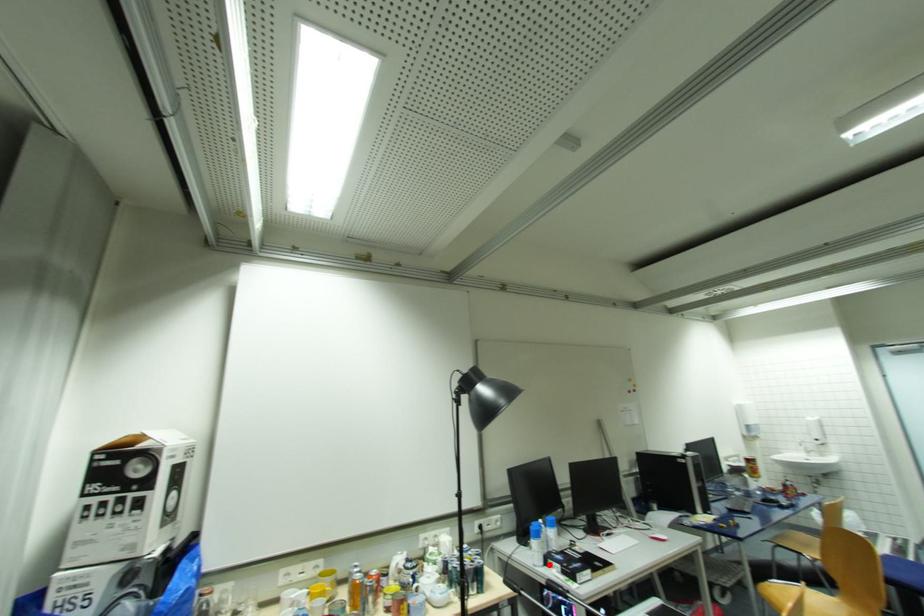
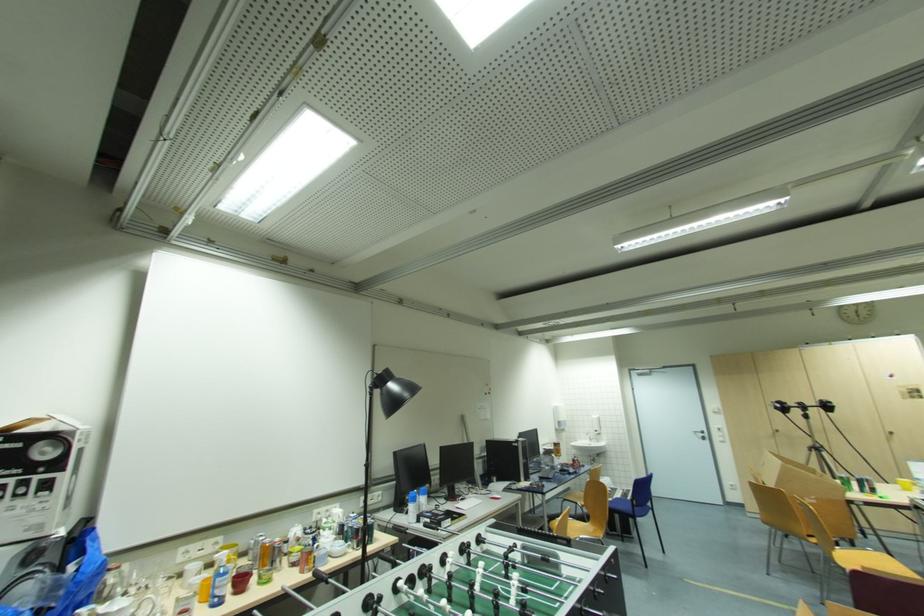
The point at the highlighted location is marked in the first image. Where is the corresponding point in the second image?

(420, 522)